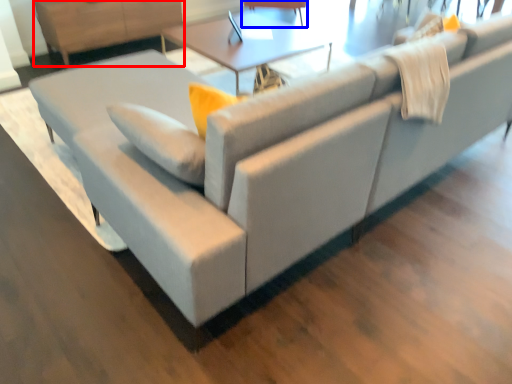
Question: Which point is closer to the camera, dresser (highlighted by a red box) or swivel chair (highlighted by a blue box)?

Choices:
 (A) dresser
 (B) swivel chair

Answer: (A)